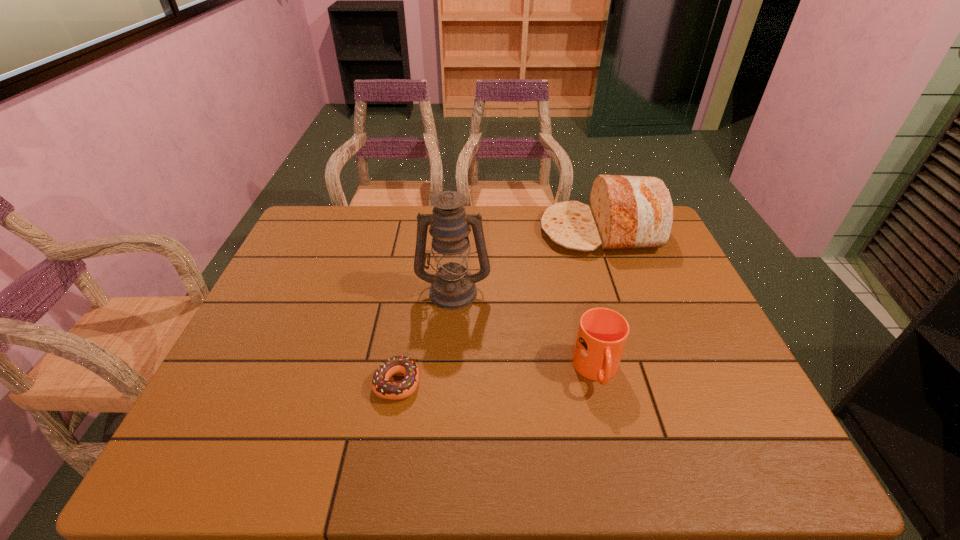
Locate which object ranks third in proximity to the shortest object. Please provide its 2D coordinates. Your answer should be formatted as a tuple, i.e. [(x, y)], where the tuple contains the x and y coordinates of a point satisfying the conditions above.

[(626, 212)]

Locate an element on the screen. The height and width of the screenshot is (540, 960). object that is the nearest to the tallest object is located at coordinates (381, 386).

Where is `free spot that satisfies the following two spatial constraints: 1. at the sliced end of the farthest object; 2. on the handle side of the mug`? The width and height of the screenshot is (960, 540). free spot that satisfies the following two spatial constraints: 1. at the sliced end of the farthest object; 2. on the handle side of the mug is located at coordinates (650, 371).

This screenshot has width=960, height=540. In order to click on free spot that satisfies the following two spatial constraints: 1. at the sliced end of the bread; 2. on the handle side of the mug in this screenshot , I will do `click(650, 371)`.

You are a GUI agent. You are given a task and a screenshot of the screen. Output one action in this format:
    pyautogui.click(x=<x>, y=<y>)
    Task: Click on the free space that satisfies the following two spatial constraints: 1. at the sliced end of the bread; 2. on the front side of the doughnut
    Image resolution: width=960 pixels, height=540 pixels.
    Given the screenshot: What is the action you would take?
    pyautogui.click(x=654, y=382)